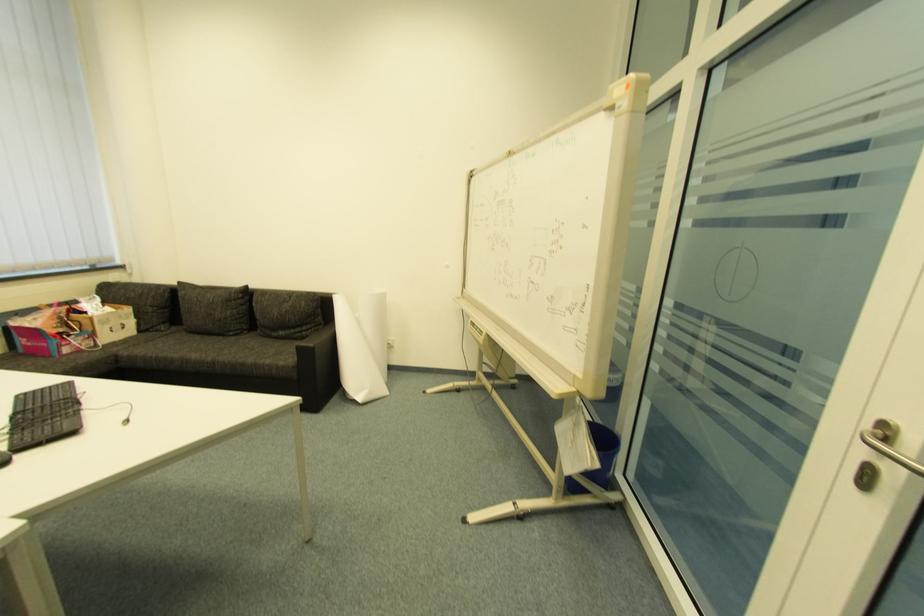
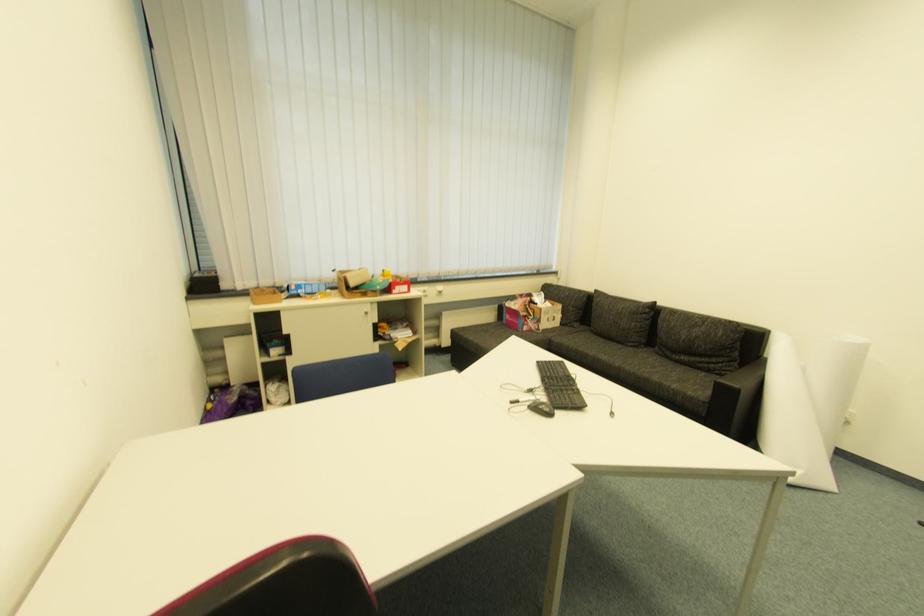
Question: The camera is either moving clockwise (left) or counter-clockwise (right) around the object. The first image is from the beginning of the video and the second image is from the end. Is the camera moving left or right when shooting the video?

Choices:
 (A) Left
 (B) Right

Answer: (B)